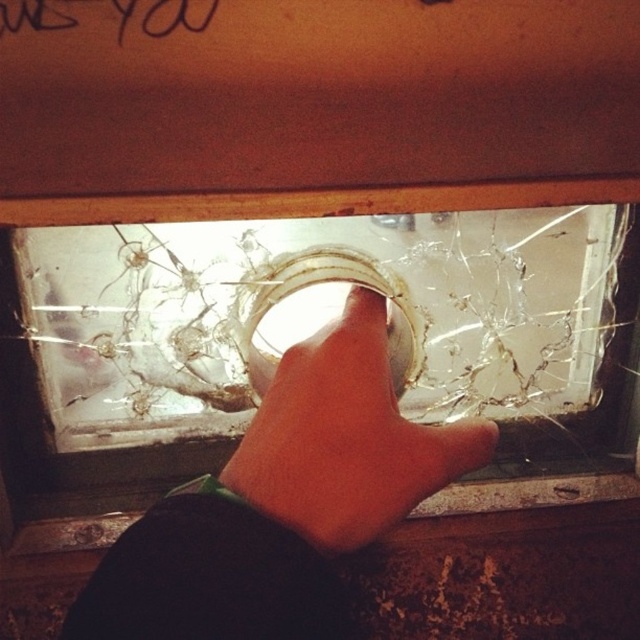
Can you confirm if light skin hand at center is taller than smooth skin hand at center?

Yes.

Which is above, light skin hand at center or smooth skin hand at center?

smooth skin hand at center is above.

Find the location of a particular element. The width and height of the screenshot is (640, 640). light skin hand at center is located at coordinates coord(282,502).

Does transparent glass window at center appear over light skin hand at center?

Yes, transparent glass window at center is above light skin hand at center.

Is point (570, 278) positioned after point (323, 579)?

Yes, it is.

Does point (458, 348) lie behind point (129, 577)?

Yes, it is behind point (129, 577).

Find the location of a particular element. transparent glass window at center is located at coordinates (298, 289).

Does transparent glass window at center appear on the left side of black ink writing at upper left?

Incorrect, transparent glass window at center is not on the left side of black ink writing at upper left.

Does transparent glass window at center appear over black ink writing at upper left?

No.

Which is behind, point (554, 307) or point (116, 12)?

Positioned behind is point (554, 307).

What are the coordinates of `transparent glass window at center` in the screenshot? It's located at (298, 289).